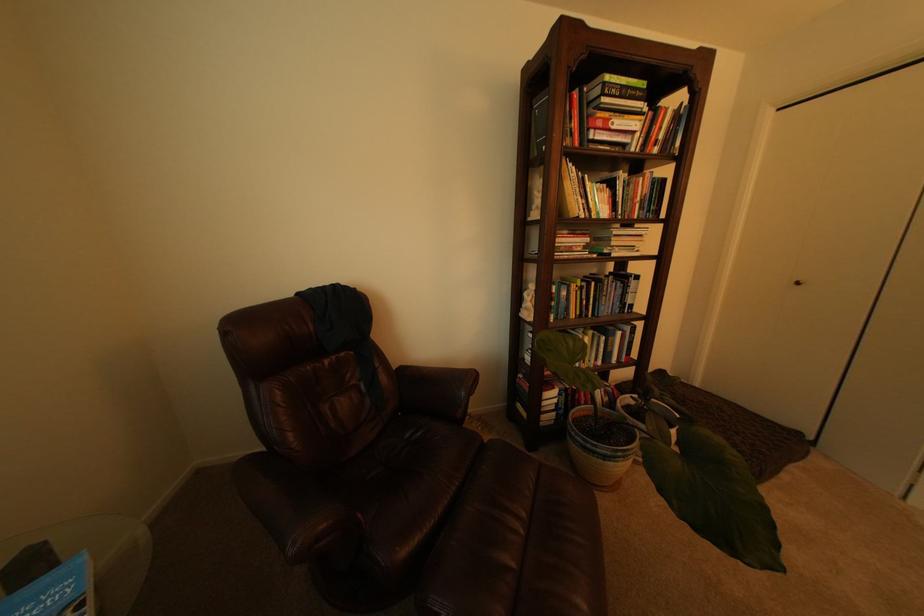
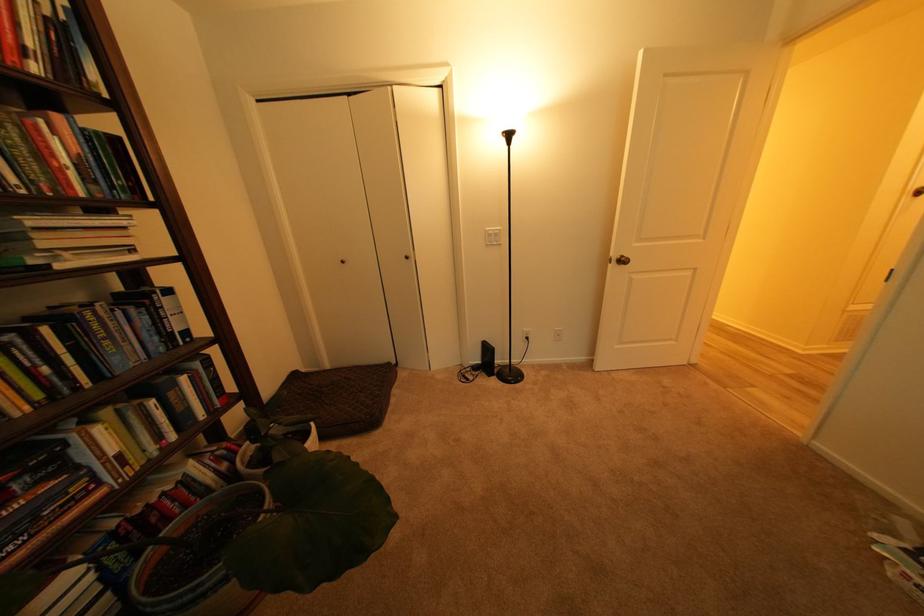
Question: The images are taken continuously from a first-person perspective. In which direction is your viewpoint rotating?

Choices:
 (A) Left
 (B) Right
 (C) Up
 (D) Down

Answer: (B)